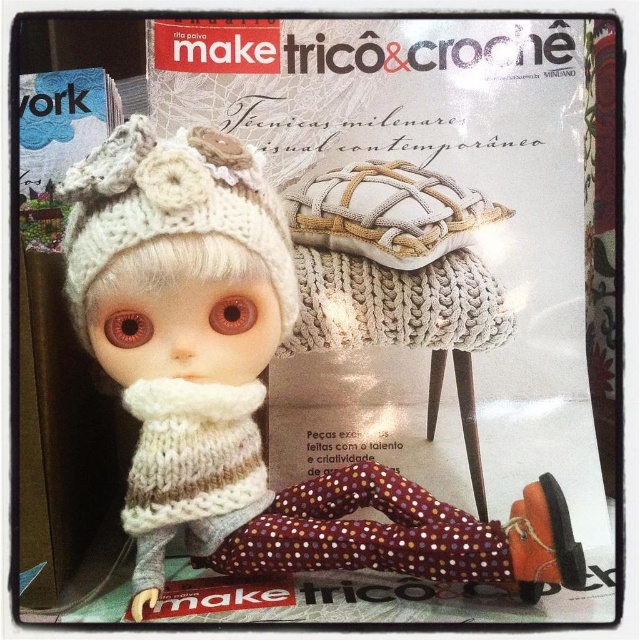
Question: Does white knitted doll at center appear under white knitted hat at center?

Choices:
 (A) no
 (B) yes

Answer: (B)

Question: Among these points, which one is nearest to the camera?

Choices:
 (A) (250, 212)
 (B) (452, 580)

Answer: (B)

Question: Does white knitted doll at center appear on the right side of white knitted hat at center?

Choices:
 (A) no
 (B) yes

Answer: (B)

Question: Which point is farther to the camera?

Choices:
 (A) white knitted doll at center
 (B) white knitted hat at center

Answer: (B)

Question: Is white knitted doll at center wider than white knitted hat at center?

Choices:
 (A) no
 (B) yes

Answer: (B)